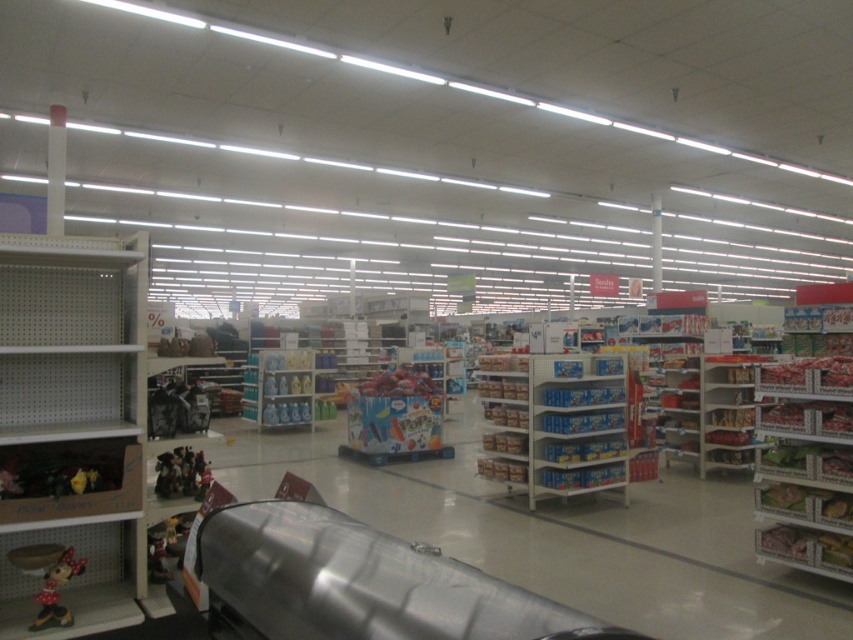
Is white matte shelf at left above metallic silver toy at lower left?

Indeed, white matte shelf at left is positioned over metallic silver toy at lower left.

Between white matte shelf at left and metallic silver toy at lower left, which one appears on the left side from the viewer's perspective?

white matte shelf at left

The image size is (853, 640). Describe the element at coordinates (71, 419) in the screenshot. I see `white matte shelf at left` at that location.

Where is `white matte shelf at left`? This screenshot has height=640, width=853. white matte shelf at left is located at coordinates (71, 419).

Who is higher up, white matte shelf at left or matte plastic minnie mouse at lower left?

Positioned higher is white matte shelf at left.

Is white matte shelf at left in front of matte plastic minnie mouse at lower left?

Yes, white matte shelf at left is in front of matte plastic minnie mouse at lower left.

Between point (15, 477) and point (41, 611), which one is positioned behind?

Point (15, 477)

Where is `white matte shelf at left`? This screenshot has width=853, height=640. white matte shelf at left is located at coordinates (71, 419).

Who is more forward, (700, 365) or (164, 538)?

Positioned in front is point (164, 538).

Is metallic silver shelves at right behind metallic silver toy at lower left?

That is True.

Where is `metallic silver shelves at right`? metallic silver shelves at right is located at coordinates (724, 412).

Where is `metallic silver shelves at right`? The image size is (853, 640). metallic silver shelves at right is located at coordinates (724, 412).